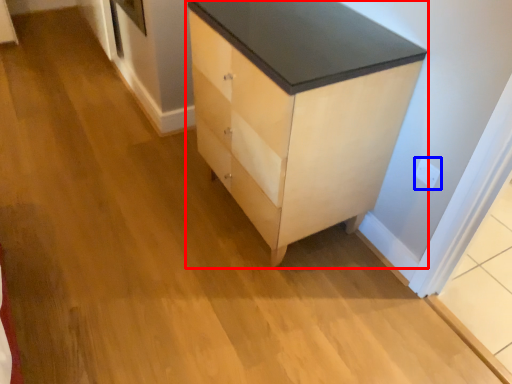
Question: Which of the following is the closest to the observer, chest of drawers (highlighted by a red box) or electric outlet (highlighted by a blue box)?

Choices:
 (A) chest of drawers
 (B) electric outlet

Answer: (A)